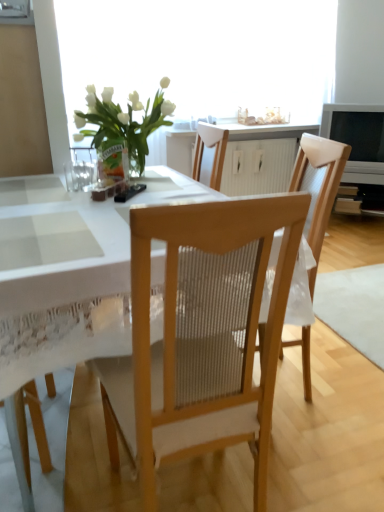
At what (x,y) coordinates should I click in order to perform the action: click on vacant area that is in front of wooden chair at center, marked as the second chair in a front-to-back arrangement. Please return your answer as a coordinate pair (x, y). Looking at the image, I should click on (312, 457).